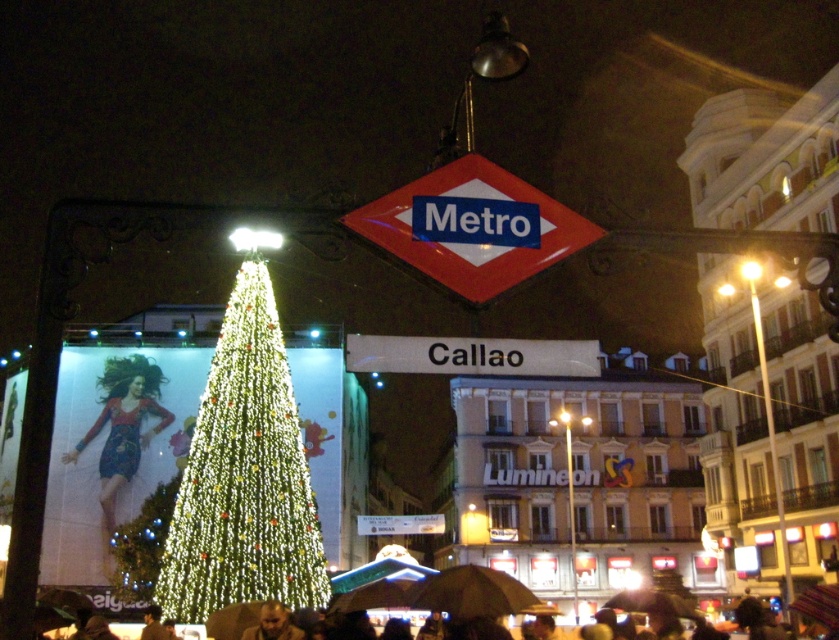
You are standing at the metro station entrance and want to take a photo of both the Christmas tree and the billboard advertisement. You notice two points marked on your camera screen at coordinates point (190, 500) and point (217, 627). Which point is closer to your camera lens?

Point (190, 500) is further to the camera than point (217, 627). Wait, no, the description says the first point is further to the camera than the second. Therefore, the second point is closer to the camera lens. So the answer is point (217, 627) is closer to the camera lens because it is less further than the other point.